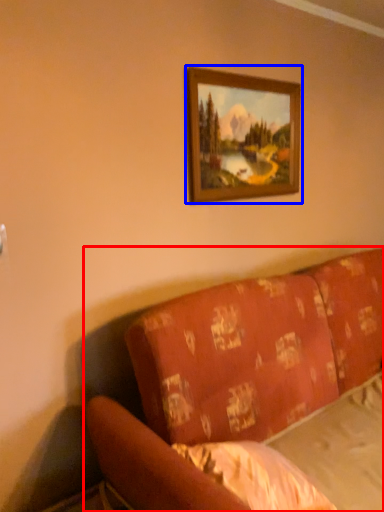
Question: Which object is further to the camera taking this photo, studio couch (highlighted by a red box) or picture frame (highlighted by a blue box)?

Choices:
 (A) studio couch
 (B) picture frame

Answer: (B)